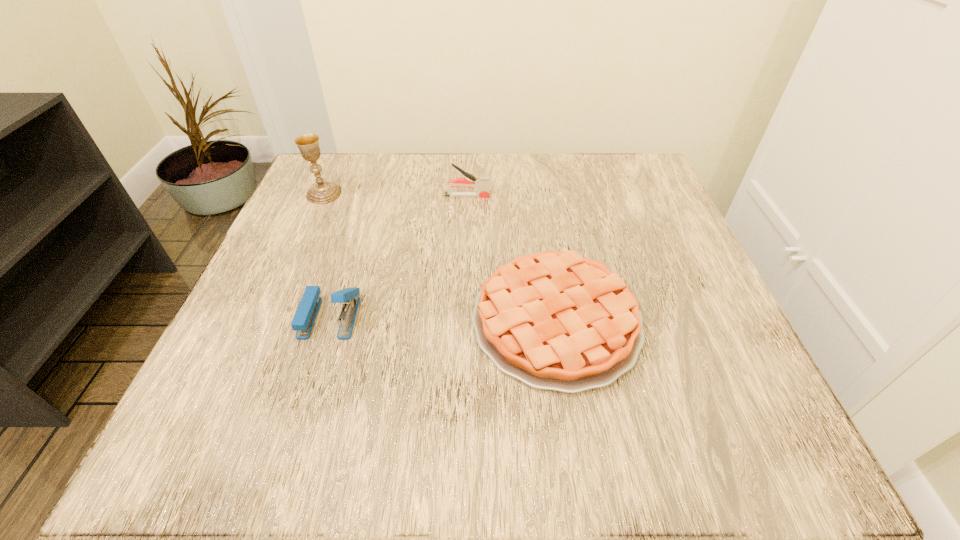
The height and width of the screenshot is (540, 960). Identify the location of free area in between the farther stapler and the chalice. (396, 195).

Locate an element on the screen. This screenshot has width=960, height=540. free space between the nearer stapler and the leftmost object is located at coordinates (327, 255).

Where is `vacant area that lies between the third object from right to left and the farther stapler`? The height and width of the screenshot is (540, 960). vacant area that lies between the third object from right to left and the farther stapler is located at coordinates (398, 256).

Where is `object that is the second nearest to the chalice`? object that is the second nearest to the chalice is located at coordinates (304, 318).

Locate an element on the screen. The height and width of the screenshot is (540, 960). the closest object relative to the pie is located at coordinates (304, 318).

This screenshot has height=540, width=960. I want to click on free space that satisfies the following two spatial constraints: 1. on the front side of the third object from right to left; 2. on the left side of the pie, so click(x=328, y=321).

Locate an element on the screen. This screenshot has width=960, height=540. blank area in the image that satisfies the following two spatial constraints: 1. on the handle side of the pie; 2. on the right side of the farther stapler is located at coordinates (463, 321).

Locate an element on the screen. The height and width of the screenshot is (540, 960). free space that satisfies the following two spatial constraints: 1. on the front side of the pie; 2. on the left side of the leftmost object is located at coordinates (268, 321).

Image resolution: width=960 pixels, height=540 pixels. Identify the location of vacant area that satisfies the following two spatial constraints: 1. on the handle side of the shortest object; 2. on the right side of the right stapler. (463, 321).

Locate an element on the screen. vacant region that satisfies the following two spatial constraints: 1. on the handle side of the farther stapler; 2. on the left side of the shortest object is located at coordinates (463, 321).